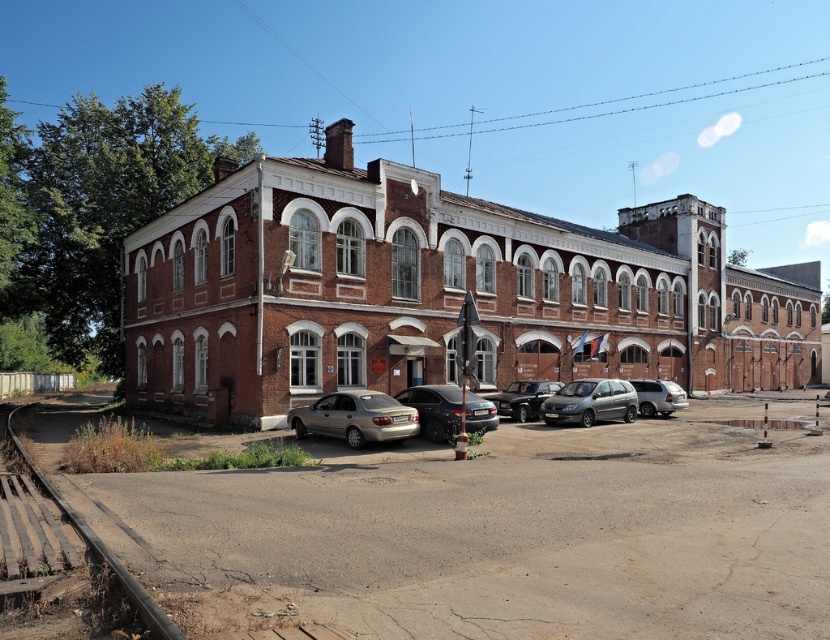
You are standing in front of the red brick building at center and want to walk to the gold metallic sedan at center. Which direction should you move to get closer to the sedan?

Since the red brick building at center is closer to you than the gold metallic sedan at center, you should move forward away from the building towards the parking area to reach the sedan.

You are standing in front of the building and want to park your car. You see two sedans at the center of the parking area. Which sedan is closer to you, the satin black sedan at center or the shiny silver sedan at center?

The satin black sedan at center is closer to you than the shiny silver sedan at center.

You are standing in front of the two story brick building and want to park your car. The slate metallic minivan at center is currently occupying a parking spot. If you want to park your car in the nearest available spot to the building, where should you park?

The nearest available parking spot to the building would be the one closest to the building that is not occupied by the slate metallic minivan at center. Since the minivan is at point (589, 403), you should look for an open spot closer to the building than that coordinate.